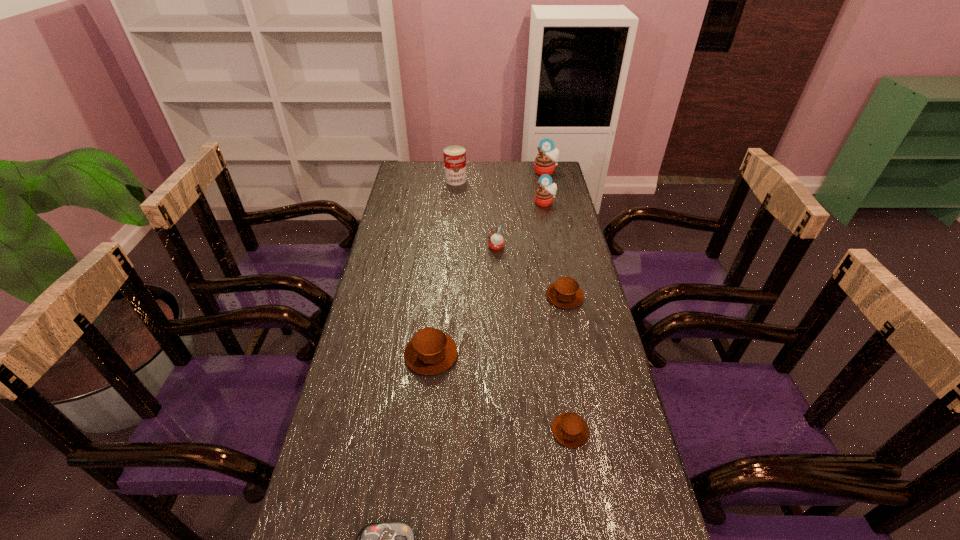
Where is `the farthest pink muffin`? the farthest pink muffin is located at coordinates click(545, 162).

Locate an element on the screen. the farthest muffin is located at coordinates (545, 162).

This screenshot has height=540, width=960. I want to click on can, so click(x=454, y=156).

Identify the location of the fifth shortest muffin. The width and height of the screenshot is (960, 540). (544, 195).

The width and height of the screenshot is (960, 540). I want to click on the second biggest pink muffin, so click(544, 195).

I want to click on the smallest pink muffin, so click(x=496, y=241).

I want to click on the fourth nearest muffin, so click(496, 241).

The width and height of the screenshot is (960, 540). Identify the location of the leftmost muffin. (430, 351).

Image resolution: width=960 pixels, height=540 pixels. What are the coordinates of `the leftmost brown muffin` in the screenshot? It's located at (430, 351).

I want to click on the fifth farthest object, so click(565, 293).